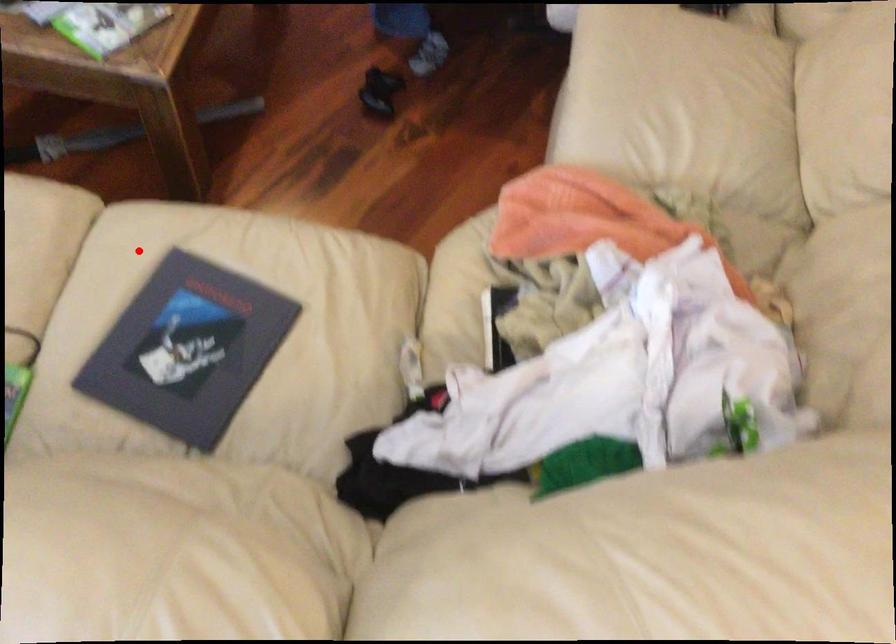
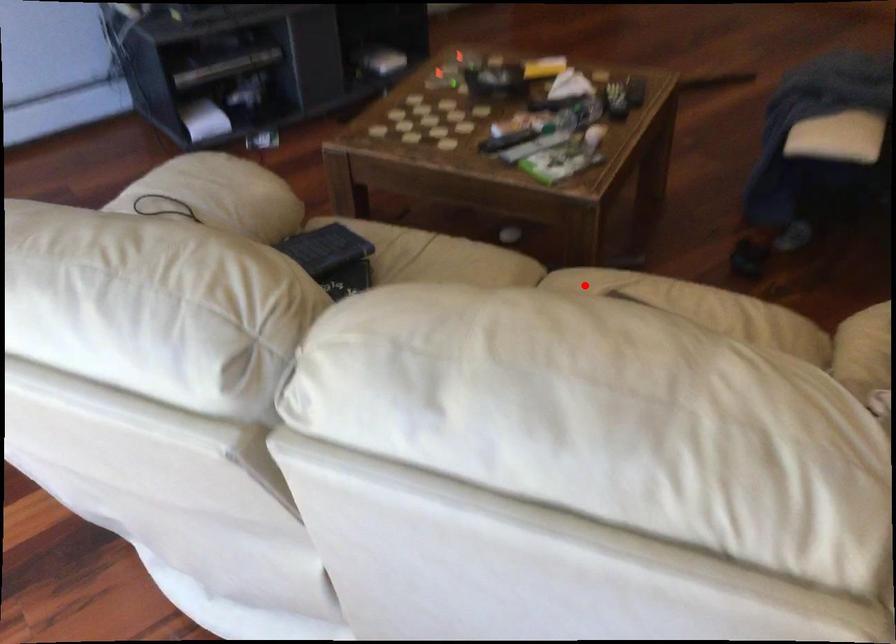
I am providing you with two images of the same scene from different viewpoints. A red point is marked on the first image and another point is marked on the second image. Is the red point in image1 aligned with the point shown in image2?

Yes